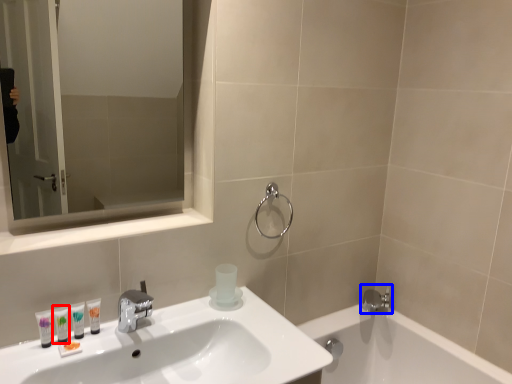
Question: Which point is further to the camera, mouthwash (highlighted by a red box) or tap (highlighted by a blue box)?

Choices:
 (A) mouthwash
 (B) tap

Answer: (B)